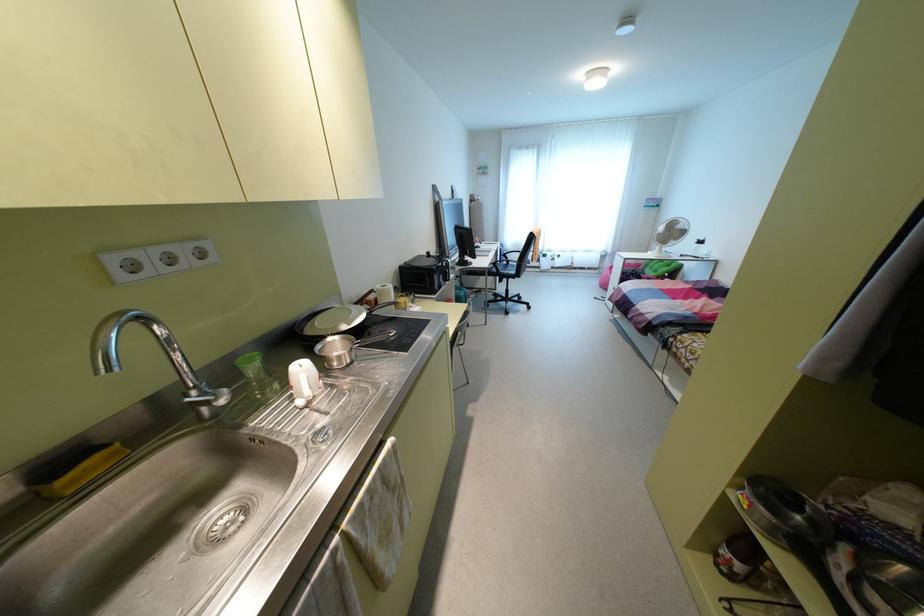
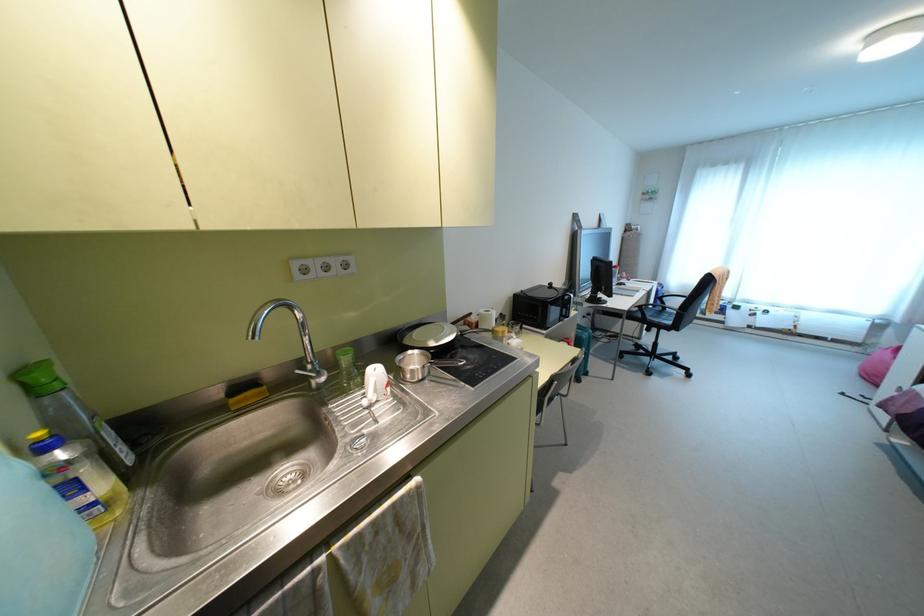
Locate, in the second image, the point that corresponds to (x=299, y=402) in the first image.

(365, 400)